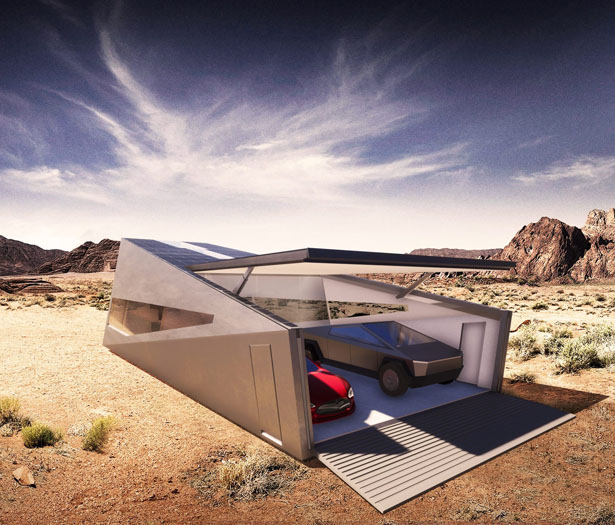
This screenshot has width=615, height=525. What are the coordinates of `window` in the screenshot? It's located at (357, 331).